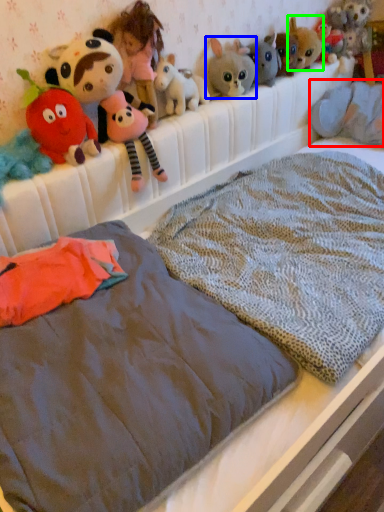
Question: Estimate the real-world distances between objects in this image. Which object is farther from animal (highlighted by a red box), toy (highlighted by a blue box) or toy (highlighted by a green box)?

Choices:
 (A) toy
 (B) toy

Answer: (A)